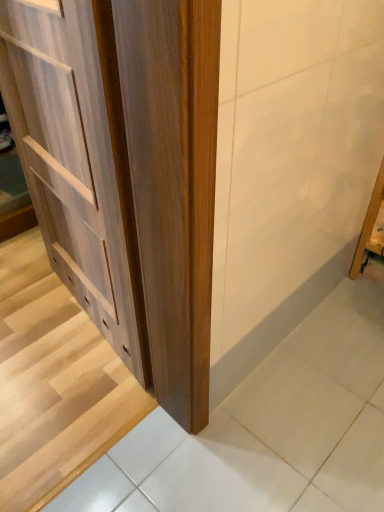
The height and width of the screenshot is (512, 384). Find the location of `vacant area on top of wooden door at center (from a real-world perspective)`. vacant area on top of wooden door at center (from a real-world perspective) is located at coordinates (46, 335).